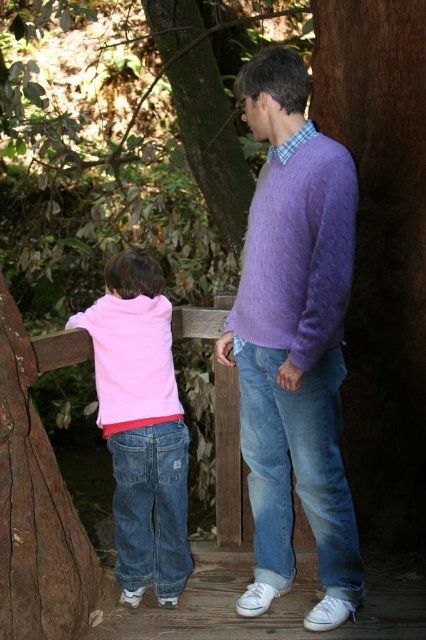
You are a photographer trying to capture a photo of the purple wool sweater at center in the image. The camera you are using has a focus point at coordinate point (293,340). Will this focus point align with the purple wool sweater at center?

Yes, the focus point at coordinate point (293,340) aligns with the purple wool sweater at center because the point indicates that location.

You are a photographer trying to capture both the pink fleece jacket at lower left and the purple fuzzy sweater at center in a single shot. Based on their positions, can you tell which one is closer to the camera?

The purple fuzzy sweater at center is behind the pink fleece jacket at lower left, so the pink fleece jacket at lower left is closer to the camera.